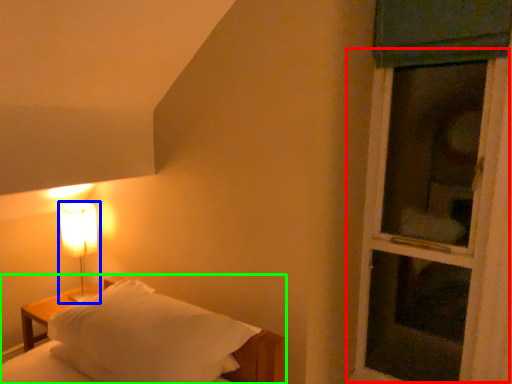
Question: Based on their relative distances, which object is nearer to screen door (highlighted by a red box)? Choose from lamp (highlighted by a blue box) and bed (highlighted by a green box).

Choices:
 (A) lamp
 (B) bed

Answer: (B)